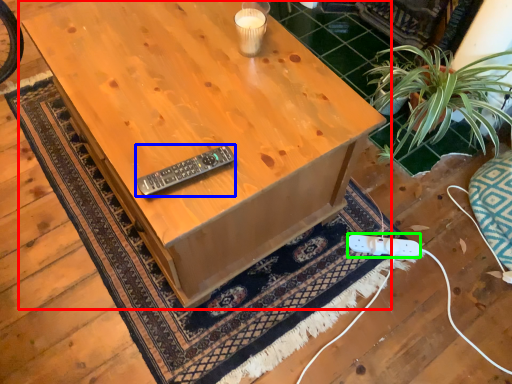
Question: Estimate the real-world distances between objects in this image. Which object is farther from table (highlighted by a red box), control (highlighted by a blue box) or plug (highlighted by a green box)?

Choices:
 (A) control
 (B) plug

Answer: (B)